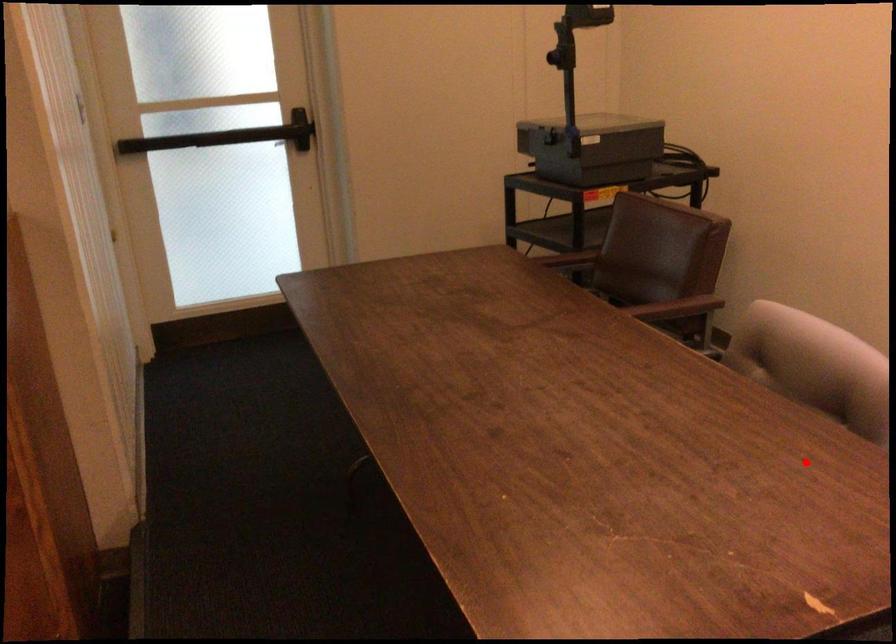
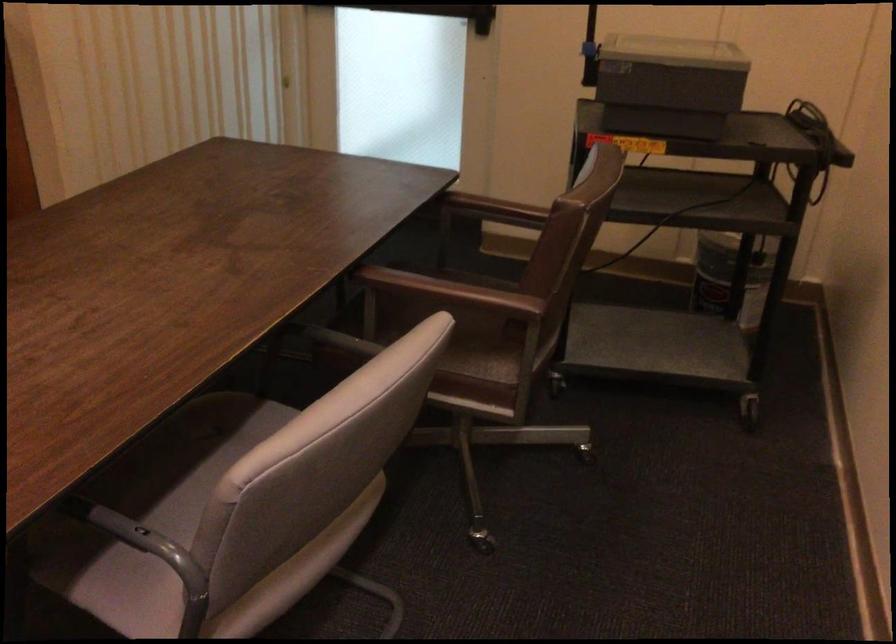
Locate, in the second image, the point that corresponds to the highlighted location in the first image.

(140, 538)